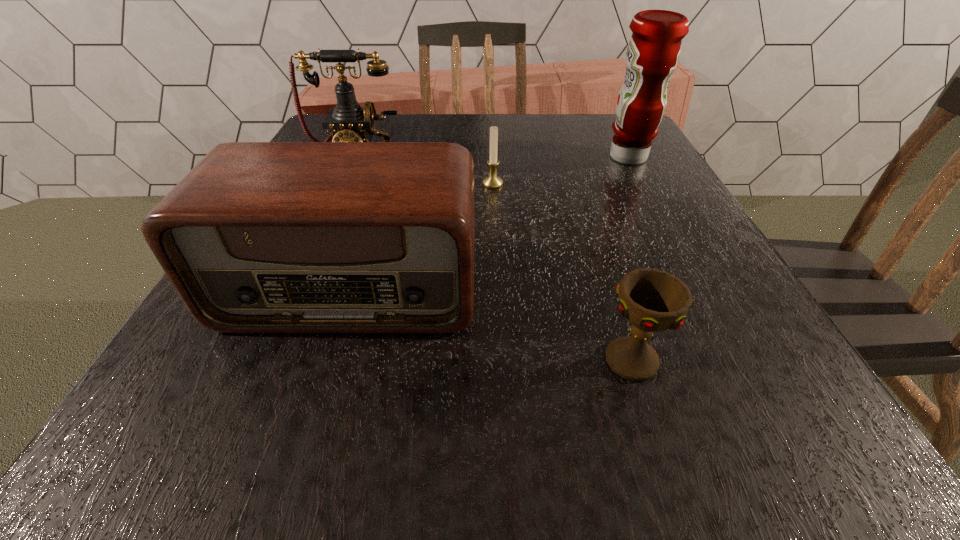
Image resolution: width=960 pixels, height=540 pixels. I want to click on free space located on the right of the chalice, so click(x=760, y=360).

What are the coordinates of `free space located on the left of the candle holder` in the screenshot? It's located at (430, 184).

Locate an element on the screen. The image size is (960, 540). condiment present at the far edge is located at coordinates (654, 48).

At what (x,y) coordinates should I click in order to perform the action: click on telephone present at the far edge. Please return your answer as a coordinate pair (x, y). The width and height of the screenshot is (960, 540). Looking at the image, I should click on (348, 122).

Where is `telephone present at the left edge`? Image resolution: width=960 pixels, height=540 pixels. telephone present at the left edge is located at coordinates tap(348, 122).

This screenshot has height=540, width=960. What are the coordinates of `radio receiver that is at the left edge` in the screenshot? It's located at (259, 237).

The height and width of the screenshot is (540, 960). In order to click on condiment located in the right edge section of the desktop in this screenshot , I will do `click(654, 48)`.

The height and width of the screenshot is (540, 960). In order to click on chalice that is at the right edge in this screenshot , I will do `click(652, 300)`.

Find the location of `object situated at the far left corner`. object situated at the far left corner is located at coordinates (348, 122).

In order to click on object positioned at the far right corner in this screenshot , I will do `click(654, 48)`.